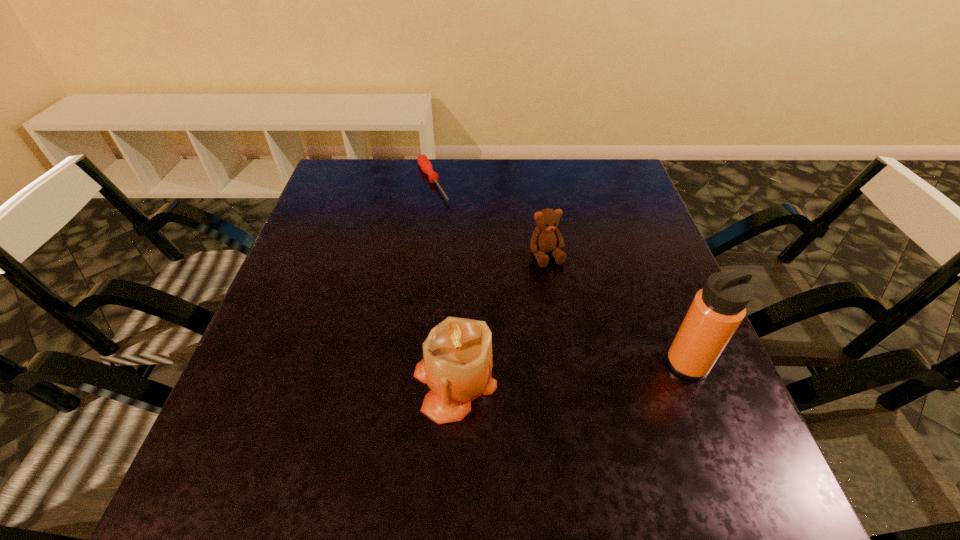
Where is `free space at the left edge`? This screenshot has width=960, height=540. free space at the left edge is located at coordinates (284, 286).

This screenshot has height=540, width=960. In the image, there is a desktop. Identify the location of vacant area at the far right corner. (588, 181).

This screenshot has height=540, width=960. Find the location of `vacant space at the near right corner of the desktop`. vacant space at the near right corner of the desktop is located at coordinates (705, 427).

At what (x,y) coordinates should I click in order to perform the action: click on free space between the shortest object and the third object from left to right. Please return your answer as a coordinate pair (x, y). Image resolution: width=960 pixels, height=540 pixels. Looking at the image, I should click on (490, 219).

The image size is (960, 540). I want to click on empty space between the second farthest object and the rightmost object, so click(616, 309).

Where is `vacant space that is in between the screwdriver and the thermos bottle`? vacant space that is in between the screwdriver and the thermos bottle is located at coordinates (560, 273).

Where is `vacant space that's between the screwdriver and the candle`? The width and height of the screenshot is (960, 540). vacant space that's between the screwdriver and the candle is located at coordinates (444, 281).

This screenshot has height=540, width=960. Find the location of `empty location between the tallest object and the teddy bear`. empty location between the tallest object and the teddy bear is located at coordinates (616, 309).

Image resolution: width=960 pixels, height=540 pixels. I want to click on free space between the teddy bear and the rightmost object, so click(x=616, y=309).

Image resolution: width=960 pixels, height=540 pixels. I want to click on vacant space that's between the screwdriver and the tallest object, so click(560, 273).